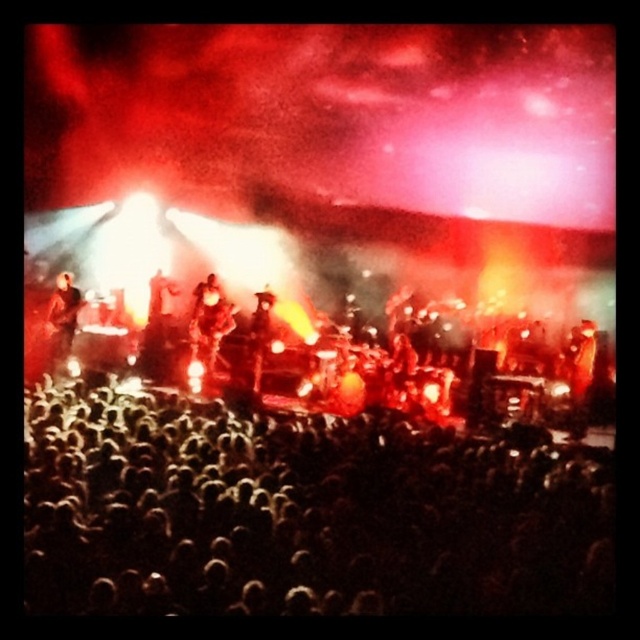
Between point (61, 356) and point (257, 346), which one is positioned in front?

Point (61, 356) is in front.

Who is higher up, black leather jacket at left or shiny black jacket at center?

black leather jacket at left is above.

Does point (61, 348) come behind point (262, 342)?

No, (61, 348) is in front of (262, 342).

I want to click on black leather jacket at left, so click(x=61, y=320).

Is black matte crowd at lower center above black leather jacket at left?

No, black matte crowd at lower center is not above black leather jacket at left.

Does black matte crowd at lower center have a greater height compared to black leather jacket at left?

Incorrect, black matte crowd at lower center's height is not larger of black leather jacket at left's.

Locate an element on the screen. This screenshot has width=640, height=640. black matte crowd at lower center is located at coordinates (304, 513).

The width and height of the screenshot is (640, 640). What are the coordinates of `black matte crowd at lower center` in the screenshot? It's located at (304, 513).

The height and width of the screenshot is (640, 640). What do you see at coordinates (304, 513) in the screenshot?
I see `black matte crowd at lower center` at bounding box center [304, 513].

Is black matte crowd at lower center above shiny gold guitar at center?

No.

Between point (228, 419) and point (189, 348), which one is positioned in front?

Point (228, 419) is in front.

This screenshot has height=640, width=640. Find the location of `black matte crowd at lower center`. black matte crowd at lower center is located at coordinates (304, 513).